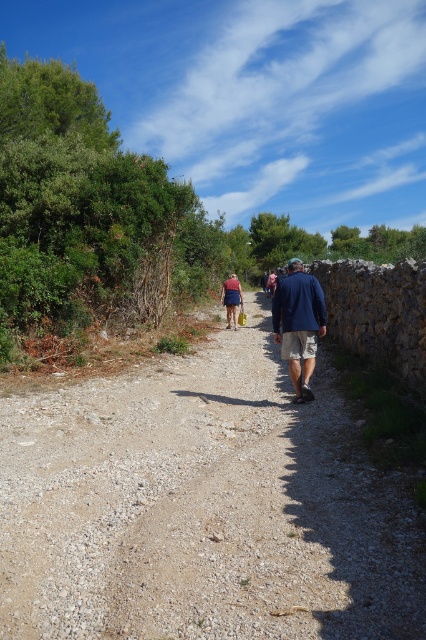
You are a hiker carrying a navy blue jacket at center and standing on the dusty gravel path at center. You want to spread out your jacket to dry. Can you lay it flat on the path without folding it?

The dusty gravel path at center has a larger size compared to navy blue jacket at center, so yes, you can lay the navy blue jacket at center flat on the dusty gravel path at center without folding it.

From the picture: You are a hiker carrying a navy blue jacket at center and standing on the dusty gravel path at center. You want to place your jacket on the ground. Which direction should you move to so that the jacket is not on the path?

The dusty gravel path at center is in front of the navy blue jacket at center. To place the jacket off the path, move it backward away from the path.

You are a hiker carrying a navy blue jacket at center and walking along the dusty gravel path at center. You want to know if you can walk sideways with your jacket without stepping off the path. Can you?

The dusty gravel path at center is wider than the navy blue jacket at center, so yes, you can walk sideways with your jacket without stepping off the path.